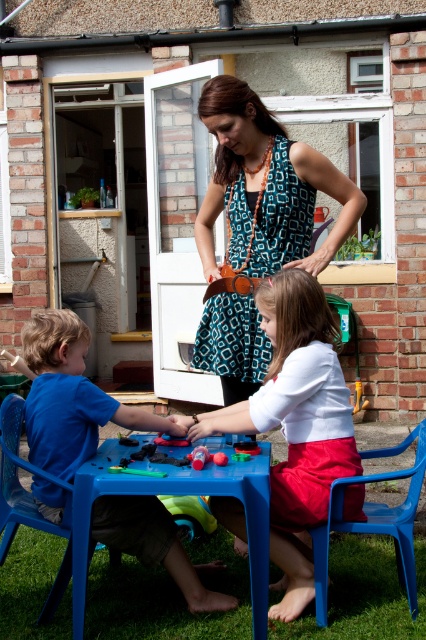
You are a parent trying to organize the backyard. You see the blue plastic chair at lower left and the rubberized plastic toy at center. Which object is closer to the ground?

The blue plastic chair at lower left is positioned under the rubberized plastic toy at center, so the blue plastic chair at lower left is closer to the ground.

You are a parent trying to arrange chairs for a small gathering. You have two blue plastic chairs in the backyard. The blue plastic chair at lower center and the blue plastic chair at lower left. Based on their positions, which chair is closer to the ground?

The blue plastic chair at lower center is closer to the ground because it is positioned below the blue plastic chair at lower left.

You are a photographer trying to capture a candid shot of the teal patterned dress at center and the blue plastic chair at lower center. Since you want to ensure both are in focus, you need to know their vertical positions. Which object is higher up in the image?

The teal patterned dress at center is above the blue plastic chair at lower center, so the teal patterned dress at center is higher up in the image.